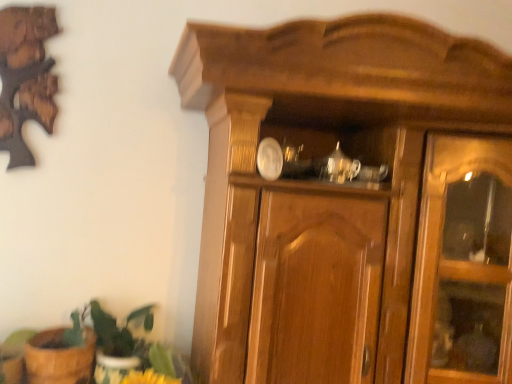
The height and width of the screenshot is (384, 512). I want to click on vacant space situated above brown woven basket at lower left (from a real-world perspective), so click(x=64, y=336).